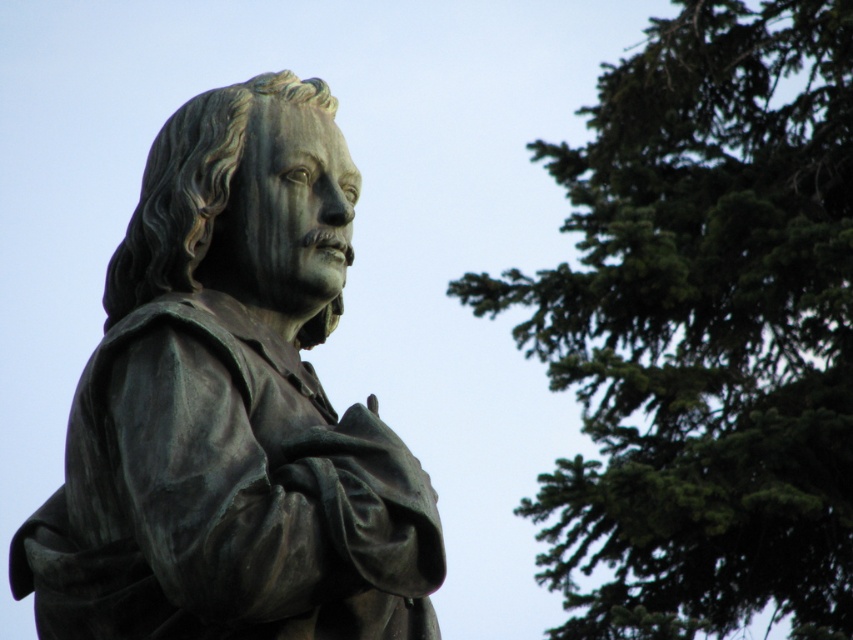
You are a photographer standing in front of the statue. You want to take a photo that includes both the statue and the sky. The statue occupies the area around point A at point [506,291] and the sky is visible near point B at point [329,621]. Since you want both points to be in focus, which point should you focus on to ensure both are sharp?

You should focus on point A at point [506,291] because it is closer to you than point B at point [329,621]. Focusing on the closer point increases the depth of field, making both points sharp.